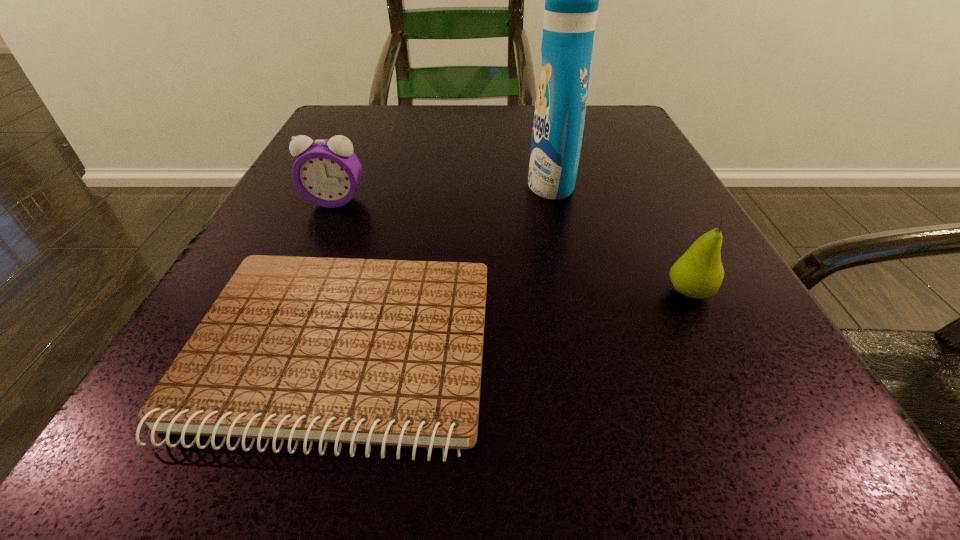
Where is `the second object from right to left`? the second object from right to left is located at coordinates (571, 0).

What are the coordinates of `detergent` in the screenshot? It's located at (571, 0).

Locate an element on the screen. pear is located at coordinates pos(698,273).

Locate an element on the screen. alarm clock is located at coordinates (327, 173).

Image resolution: width=960 pixels, height=540 pixels. Find the location of `notebook`. notebook is located at coordinates (387, 352).

The width and height of the screenshot is (960, 540). I want to click on vacant space located 0.080m on the front-facing side of the second object from right to left, so click(x=481, y=184).

At what (x,y) coordinates should I click in order to perform the action: click on free region located on the front-facing side of the second object from right to left. Please return your answer as a coordinate pair (x, y). The width and height of the screenshot is (960, 540). Looking at the image, I should click on (463, 184).

This screenshot has width=960, height=540. I want to click on free location located on the front-facing side of the second object from right to left, so click(x=463, y=184).

I want to click on free space located 0.150m on the front of the pear, so click(756, 423).

The width and height of the screenshot is (960, 540). In order to click on vacant area situated on the face of the alarm clock in this screenshot , I will do `click(276, 329)`.